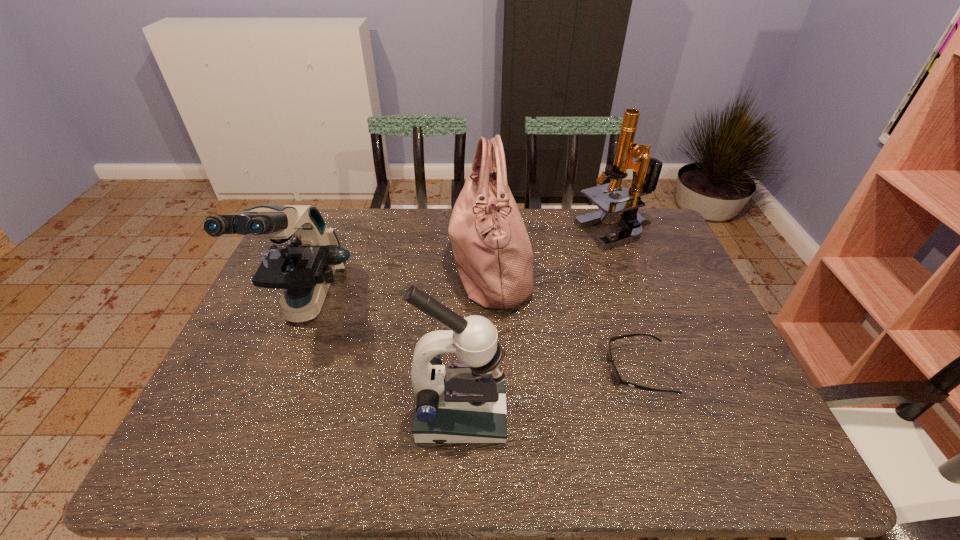
Identify the location of empty location between the handbag and the farthest microscope. (553, 248).

Identify the location of free space that is in between the farthest microscope and the sunglasses. 627,300.

Where is `unoccupied position between the leftmost object and the handbag`? The width and height of the screenshot is (960, 540). unoccupied position between the leftmost object and the handbag is located at coordinates (398, 284).

At what (x,y) coordinates should I click in order to perform the action: click on free space between the shortest object and the rightmost microscope. Please return your answer as a coordinate pair (x, y). The width and height of the screenshot is (960, 540). Looking at the image, I should click on (627, 300).

Find the location of a particular element. Image resolution: width=960 pixels, height=540 pixels. empty location between the second microscope from left to right and the leftmost microscope is located at coordinates (384, 359).

Where is `vacant space in between the second microscope from left to right and the sunglasses`? The height and width of the screenshot is (540, 960). vacant space in between the second microscope from left to right and the sunglasses is located at coordinates (550, 392).

Choose which object is the second nearest neighbor to the rightmost microscope. Please provide its 2D coordinates. Your answer should be formatted as a tuple, i.e. [(x, y)], where the tuple contains the x and y coordinates of a point satisfying the conditions above.

[(618, 379)]

Image resolution: width=960 pixels, height=540 pixels. Identify the location of the second closest object relative to the handbag. (618, 379).

Where is `microscope that stands as the closest to the second microscope from left to right`? This screenshot has height=540, width=960. microscope that stands as the closest to the second microscope from left to right is located at coordinates (305, 254).

Choose which microscope is the second nearest neighbor to the second microscope from right to left. Please provide its 2D coordinates. Your answer should be formatted as a tuple, i.e. [(x, y)], where the tuple contains the x and y coordinates of a point satisfying the conditions above.

[(646, 170)]